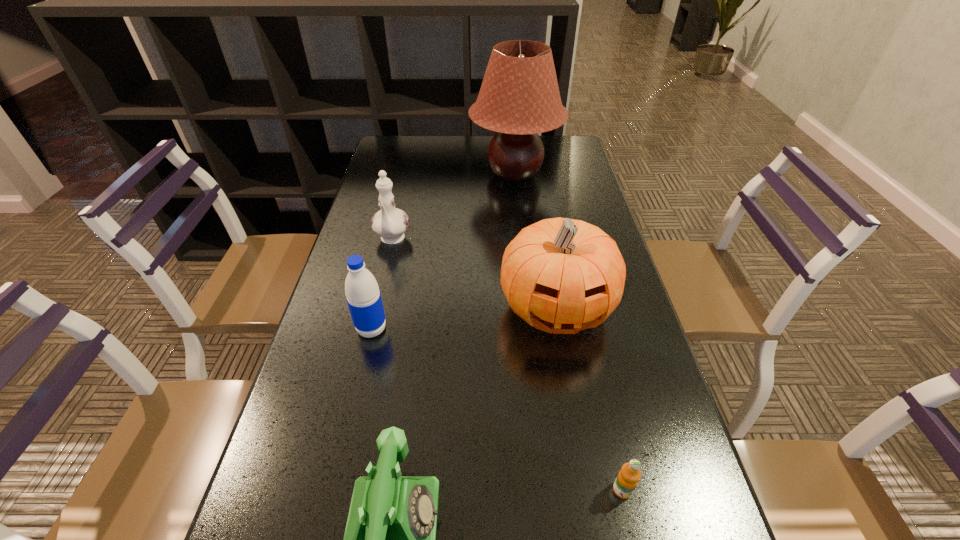
In order to click on lampshade in this screenshot , I will do `click(519, 97)`.

You are a GUI agent. You are given a task and a screenshot of the screen. Output one action in this format:
    pyautogui.click(x=<x>, y=<y>)
    Task: Click on the farthest object
    This screenshot has width=960, height=540.
    Given the screenshot: What is the action you would take?
    pyautogui.click(x=519, y=97)

I want to click on the second tallest object, so pyautogui.click(x=560, y=275).

Where is `chinaware`? chinaware is located at coordinates (390, 223).

This screenshot has height=540, width=960. Find the location of `water bottle`. water bottle is located at coordinates (362, 292).

Identify the location of the shortest object. (627, 479).

I want to click on blank space located 0.160m on the front-facing side of the tallest object, so click(x=423, y=173).

Where is `free space located on the front-facing side of the tallest object`? This screenshot has width=960, height=540. free space located on the front-facing side of the tallest object is located at coordinates (444, 173).

Image resolution: width=960 pixels, height=540 pixels. Identify the location of free space located 0.270m on the front-facing side of the tallest object. (391, 173).

This screenshot has width=960, height=540. I want to click on free space located on the front-facing side of the second tallest object, so click(x=595, y=536).